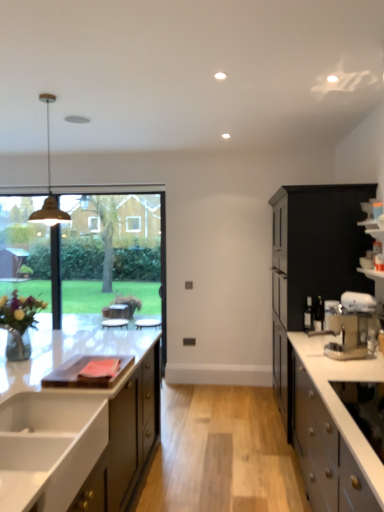
Question: Considering the relative sizes of white glossy sink at lower left and matte black cabinet at right, the 1th cabinetry in the right-to-left sequence, in the image provided, is white glossy sink at lower left wider than matte black cabinet at right, the 1th cabinetry in the right-to-left sequence,?

Choices:
 (A) no
 (B) yes

Answer: (A)

Question: Are white glossy sink at lower left and matte black cabinet at right, the 1th cabinetry in the right-to-left sequence, far apart?

Choices:
 (A) no
 (B) yes

Answer: (B)

Question: Does white glossy sink at lower left lie behind matte black cabinet at right, the 1th cabinetry in the right-to-left sequence?

Choices:
 (A) yes
 (B) no

Answer: (B)

Question: Does white glossy sink at lower left have a greater height compared to matte black cabinet at right, which is the third cabinetry from left to right?

Choices:
 (A) no
 (B) yes

Answer: (A)

Question: Is white glossy sink at lower left turned away from matte black cabinet at right, which is the third cabinetry from left to right?

Choices:
 (A) yes
 (B) no

Answer: (B)

Question: Based on their sizes in the image, would you say transparent glass window at center, acting as the 1th window screen starting from the right, is bigger or smaller than metallic silver coffee machine at right?

Choices:
 (A) small
 (B) big

Answer: (B)

Question: Relative to metallic silver coffee machine at right, is transparent glass window at center, acting as the second window screen starting from the left, in front or behind?

Choices:
 (A) front
 (B) behind

Answer: (B)

Question: Is transparent glass window at center, acting as the 1th window screen starting from the right, wider or thinner than metallic silver coffee machine at right?

Choices:
 (A) wide
 (B) thin

Answer: (B)

Question: In terms of height, does transparent glass window at center, acting as the second window screen starting from the left, look taller or shorter compared to metallic silver coffee machine at right?

Choices:
 (A) short
 (B) tall

Answer: (B)

Question: From the image's perspective, relative to matte black cabinet at right, which is the third cabinetry from left to right, is matte brass pendant light at upper left above or below?

Choices:
 (A) above
 (B) below

Answer: (A)

Question: In the image, is matte brass pendant light at upper left positioned in front of or behind matte black cabinet at right, which is the third cabinetry from left to right?

Choices:
 (A) front
 (B) behind

Answer: (A)

Question: Which is correct: matte brass pendant light at upper left is inside matte black cabinet at right, the 1th cabinetry in the right-to-left sequence, or outside of it?

Choices:
 (A) outside
 (B) inside

Answer: (A)

Question: Considering the positions of point (29, 216) and point (314, 229), is point (29, 216) closer or farther from the camera than point (314, 229)?

Choices:
 (A) farther
 (B) closer

Answer: (A)

Question: Would you say white matte cabinet at right, which is counted as the second cabinetry, starting from the right, is to the left or to the right of transparent glass window at center, acting as the 1th window screen starting from the right, in the picture?

Choices:
 (A) left
 (B) right

Answer: (B)

Question: Relative to transparent glass window at center, acting as the second window screen starting from the left, is white matte cabinet at right, which is counted as the second cabinetry, starting from the right, in front or behind?

Choices:
 (A) front
 (B) behind

Answer: (A)